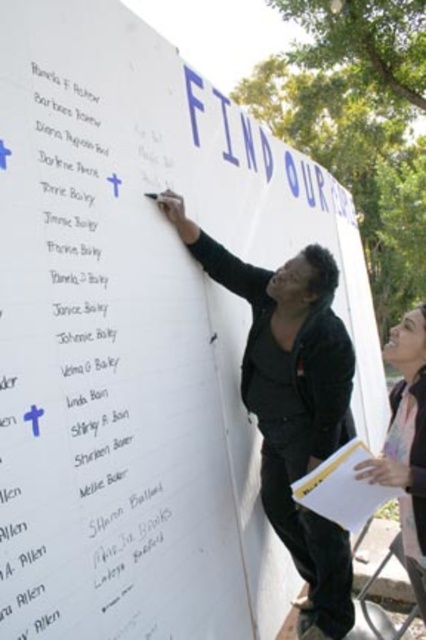
Consider the image. Is matte black jacket at center taller than light brown hair at upper right?

Correct, matte black jacket at center is much taller as light brown hair at upper right.

Can you confirm if matte black jacket at center is positioned to the left of light brown hair at upper right?

Indeed, matte black jacket at center is positioned on the left side of light brown hair at upper right.

I want to click on matte black jacket at center, so click(x=291, y=401).